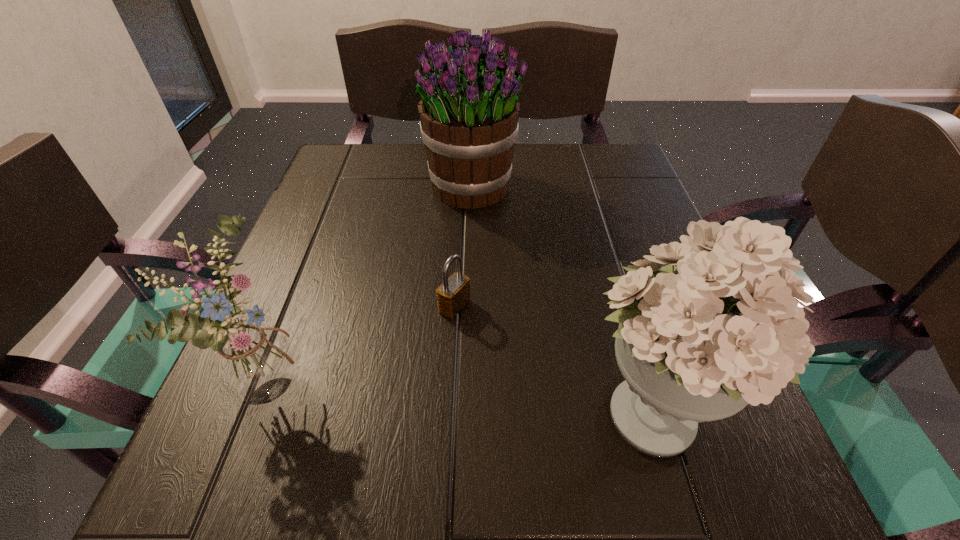
Locate an element on the screen. This screenshot has height=540, width=960. free region that satisfies the following two spatial constraints: 1. on the back side of the shortest object; 2. on the right side of the farthest object is located at coordinates pos(461,187).

Where is `blank area in the image that satisfies the following two spatial constraints: 1. on the front-facing side of the rightmost bouquet; 2. on the left side of the leftmost bouquet`? The height and width of the screenshot is (540, 960). blank area in the image that satisfies the following two spatial constraints: 1. on the front-facing side of the rightmost bouquet; 2. on the left side of the leftmost bouquet is located at coordinates (263, 409).

The image size is (960, 540). I want to click on free space in the image that satisfies the following two spatial constraints: 1. on the front side of the shortest object; 2. on the right side of the rightmost object, so click(449, 409).